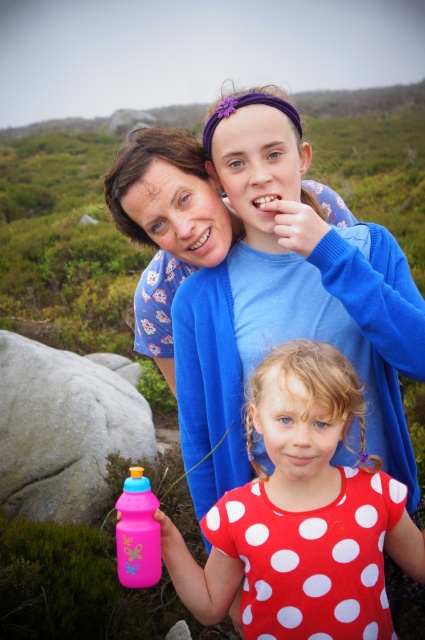
You are a photographer setting up a shot of the gray rough rock at lower left and the pink plastic bottle at lower left. To ensure both are in frame, where should you position your camera relative to the objects?

Position the camera to the right side of the gray rough rock at lower left and pink plastic bottle at lower left so both are visible in the frame.

From the picture: You are a photographer trying to capture a clear shot of both the pink plastic water bottle at center and the gray rough rock at lower left. Based on their positions, which object will appear larger in the photo?

The pink plastic water bottle at center will appear larger in the photo because it is closer to the viewer than the gray rough rock at lower left.